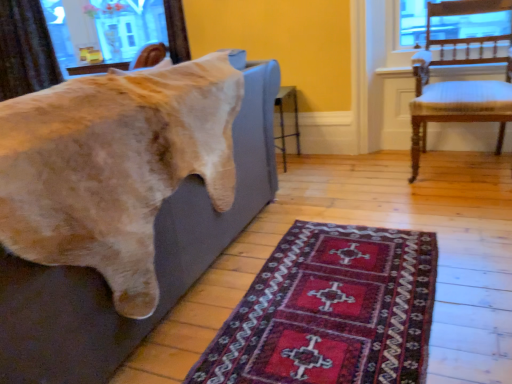
The height and width of the screenshot is (384, 512). What do you see at coordinates (459, 81) in the screenshot?
I see `wooden chair with white cushioning at right` at bounding box center [459, 81].

Identify the location of dark red woven rug at lower center. Image resolution: width=512 pixels, height=384 pixels. (331, 311).

Is brown textured curtain at upper left directly adjacent to wooden chair with white cushioning at right?

brown textured curtain at upper left and wooden chair with white cushioning at right are clearly separated.

Based on the photo, could you tell me if brown textured curtain at upper left is turned towards wooden chair with white cushioning at right?

No, brown textured curtain at upper left is not aimed at wooden chair with white cushioning at right.

Is dark red woven rug at lower center wider than wooden chair with white cushioning at right?

Yes, dark red woven rug at lower center is wider than wooden chair with white cushioning at right.

How many degrees apart are the facing directions of dark red woven rug at lower center and wooden chair with white cushioning at right?

dark red woven rug at lower center and wooden chair with white cushioning at right are facing 1.57 degrees away from each other.

From a real-world perspective, is dark red woven rug at lower center over wooden chair with white cushioning at right?

No, from a real-world perspective, dark red woven rug at lower center is not above wooden chair with white cushioning at right.

In the image, is dark red woven rug at lower center on the left side or the right side of wooden chair with white cushioning at right?

In the image, dark red woven rug at lower center appears on the left side of wooden chair with white cushioning at right.

From the image's perspective, is soft gray couch at left located above or below wooden chair with white cushioning at right?

soft gray couch at left is situated lower than wooden chair with white cushioning at right in the image.

How different are the orientations of soft gray couch at left and wooden chair with white cushioning at right in degrees?

The angle between the facing direction of soft gray couch at left and the facing direction of wooden chair with white cushioning at right is 89.9 degrees.

Is soft gray couch at left positioned before wooden chair with white cushioning at right?

Yes, it is in front of wooden chair with white cushioning at right.

Is soft gray couch at left facing towards wooden chair with white cushioning at right?

No, soft gray couch at left does not turn towards wooden chair with white cushioning at right.

Between point (494, 89) and point (249, 299), which one is positioned in front?

Positioned in front is point (249, 299).

Could you tell me if wooden chair with white cushioning at right is turned towards dark red woven rug at lower center?

Yes, wooden chair with white cushioning at right faces towards dark red woven rug at lower center.

Relative to dark red woven rug at lower center, is wooden chair with white cushioning at right in front or behind?

In the image, wooden chair with white cushioning at right appears behind dark red woven rug at lower center.

Considering the relative positions of wooden chair with white cushioning at right and dark red woven rug at lower center in the image provided, is wooden chair with white cushioning at right to the left or to the right of dark red woven rug at lower center?

wooden chair with white cushioning at right is positioned on dark red woven rug at lower center's right side.

Between wooden chair with white cushioning at right and brown textured curtain at upper left, which one has larger width?

With larger width is wooden chair with white cushioning at right.

Which is less distant, (502,109) or (42,20)?

Point (502,109) is closer to the camera than point (42,20).

Is wooden chair with white cushioning at right not close to brown textured curtain at upper left?

Absolutely, wooden chair with white cushioning at right is distant from brown textured curtain at upper left.

Is brown textured curtain at upper left turned away from soft gray couch at left?

No.

From the image's perspective, does brown textured curtain at upper left appear higher than soft gray couch at left?

Yes.

Is brown textured curtain at upper left placed right next to soft gray couch at left?

No.

The width and height of the screenshot is (512, 384). Identify the location of curtain behind the soft gray couch at left. (25, 49).

Is dark red woven rug at lower center inside the boundaries of soft gray couch at left, or outside?

dark red woven rug at lower center is outside soft gray couch at left.

Is dark red woven rug at lower center far from soft gray couch at left?

Actually, dark red woven rug at lower center and soft gray couch at left are a little close together.

How different are the orientations of dark red woven rug at lower center and soft gray couch at left in degrees?

There is a 91.4-degree angle between the facing directions of dark red woven rug at lower center and soft gray couch at left.

Is dark red woven rug at lower center in front of or behind soft gray couch at left in the image?

dark red woven rug at lower center is positioned farther from the viewer than soft gray couch at left.

The height and width of the screenshot is (384, 512). Identify the location of chair that appears on the right of brown textured curtain at upper left. (459, 81).

Find the location of `mat that appears below the wooden chair with white cushioning at right (from the image's perspective)`. mat that appears below the wooden chair with white cushioning at right (from the image's perspective) is located at coordinates (331, 311).

Estimate the real-world distances between objects in this image. Which object is closer to wooden chair with white cushioning at right, dark red woven rug at lower center or brown textured curtain at upper left?

The object closer to wooden chair with white cushioning at right is dark red woven rug at lower center.

Estimate the real-world distances between objects in this image. Which object is further from wooden chair with white cushioning at right, soft gray couch at left or dark red woven rug at lower center?

soft gray couch at left.

Considering their positions, is soft gray couch at left positioned further to brown textured curtain at upper left than wooden chair with white cushioning at right?

wooden chair with white cushioning at right is positioned further to the anchor brown textured curtain at upper left.

Based on their spatial positions, is soft gray couch at left or wooden chair with white cushioning at right closer to dark red woven rug at lower center?

soft gray couch at left.

Estimate the real-world distances between objects in this image. Which object is further from brown textured curtain at upper left, soft gray couch at left or dark red woven rug at lower center?

Based on the image, dark red woven rug at lower center appears to be further to brown textured curtain at upper left.

Looking at the image, which one is located further to dark red woven rug at lower center, wooden chair with white cushioning at right or brown textured curtain at upper left?

The object further to dark red woven rug at lower center is brown textured curtain at upper left.

From the picture: When comparing their distances from brown textured curtain at upper left, does dark red woven rug at lower center or wooden chair with white cushioning at right seem closer?

wooden chair with white cushioning at right is positioned closer to the anchor brown textured curtain at upper left.

From the image, which object appears to be farther from wooden chair with white cushioning at right, soft gray couch at left or brown textured curtain at upper left?

brown textured curtain at upper left.

At what (x,y) coordinates should I click in order to perform the action: click on mat situated between soft gray couch at left and wooden chair with white cushioning at right from left to right. Please return your answer as a coordinate pair (x, y). Looking at the image, I should click on (331, 311).

At what (x,y) coordinates should I click in order to perform the action: click on mat located between soft gray couch at left and brown textured curtain at upper left in the depth direction. Please return your answer as a coordinate pair (x, y). This screenshot has height=384, width=512. Looking at the image, I should click on (331, 311).

I want to click on mat between brown textured curtain at upper left and wooden chair with white cushioning at right, so click(331, 311).

Image resolution: width=512 pixels, height=384 pixels. Identify the location of furniture situated between brown textured curtain at upper left and wooden chair with white cushioning at right from left to right. (155, 262).